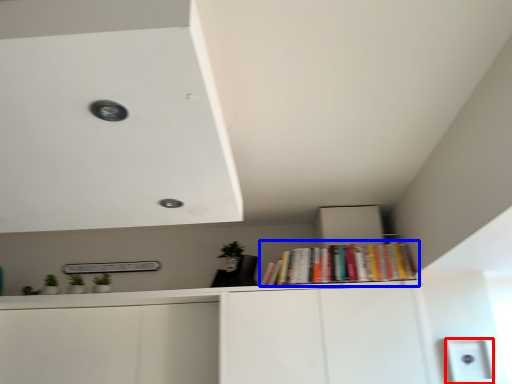
Question: Which of the following is the closest to the observer, light switch (highlighted by a red box) or book (highlighted by a blue box)?

Choices:
 (A) light switch
 (B) book

Answer: (A)